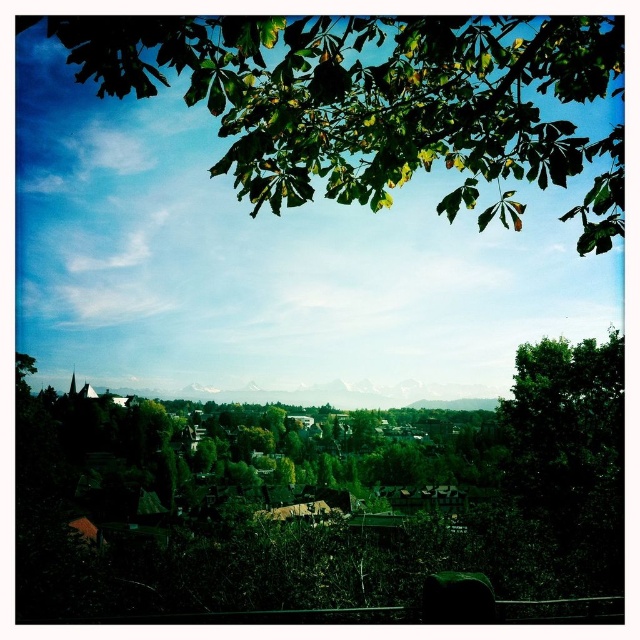
Question: Does green leafy tree at upper center have a larger size compared to green leafy tree at right?

Choices:
 (A) no
 (B) yes

Answer: (B)

Question: Which point appears farthest from the camera in this image?

Choices:
 (A) (570, 376)
 (B) (390, 177)
 (C) (476, 392)

Answer: (C)

Question: Which point is closer to the camera?

Choices:
 (A) (611, 403)
 (B) (125, 29)
 (C) (403, 397)

Answer: (B)

Question: Which point is closer to the camera?

Choices:
 (A) (611, 419)
 (B) (467, 208)
 (C) (422, 401)

Answer: (A)

Question: Does green leafy tree at upper center have a lesser width compared to green grassy hillside at center?

Choices:
 (A) yes
 (B) no

Answer: (B)

Question: Does green leafy tree at right have a lesser width compared to green grassy hillside at center?

Choices:
 (A) yes
 (B) no

Answer: (A)